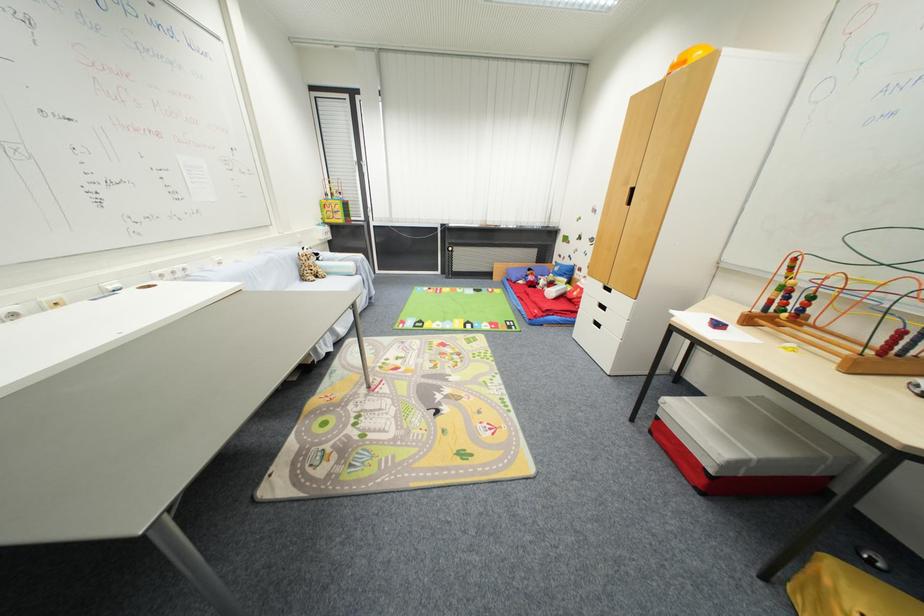
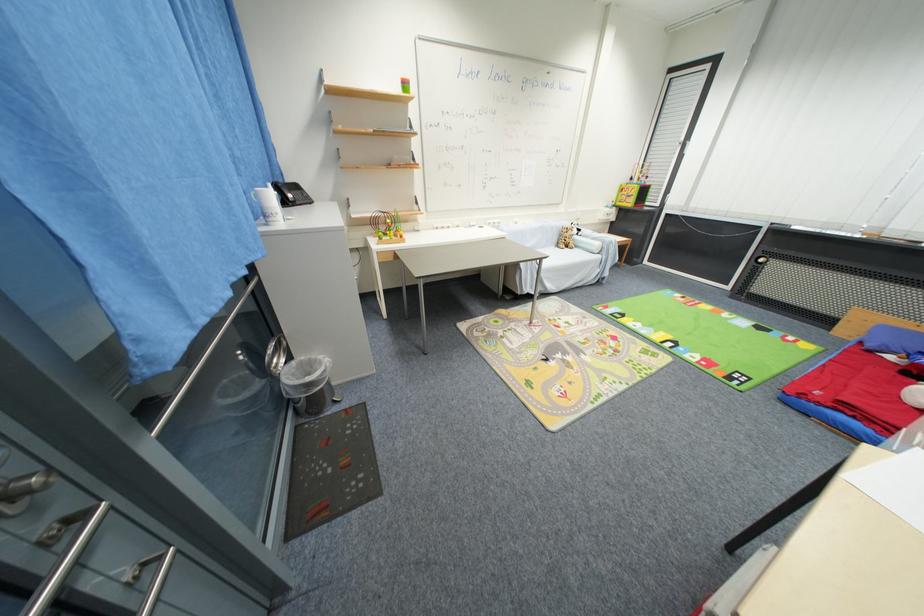
Find the pixel in the second image that matches (323,282) in the first image.

(572, 251)